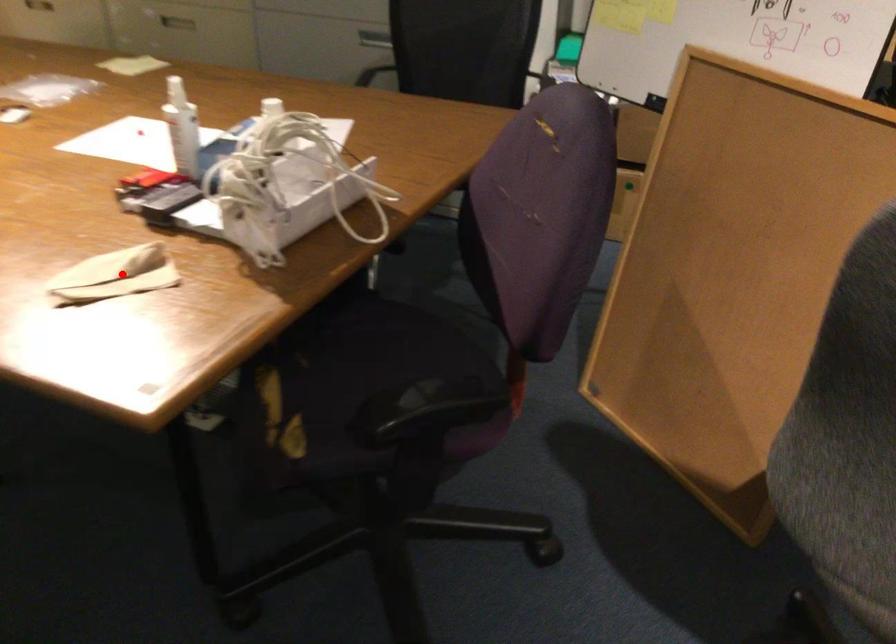
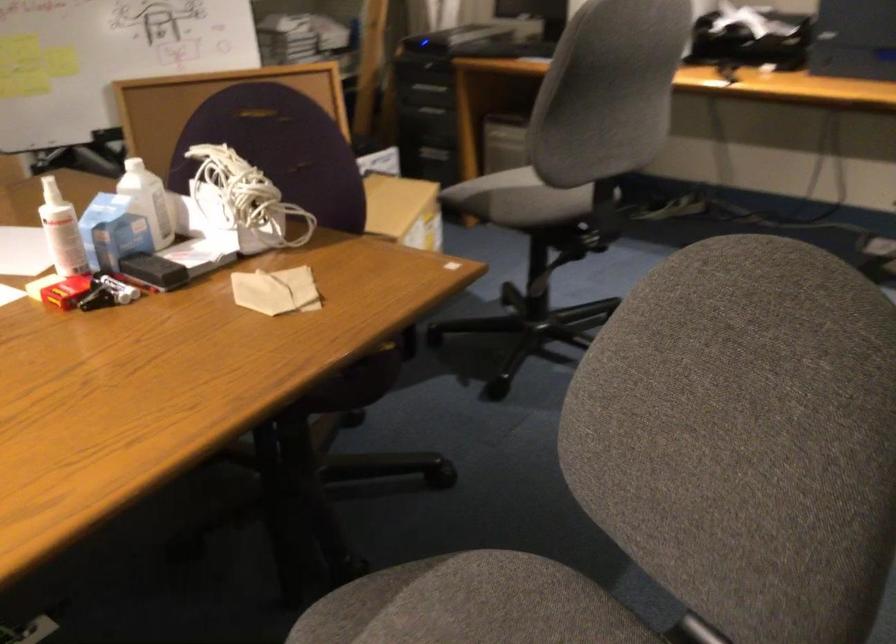
Question: I am providing you with two images of the same scene from different viewpoints. Given a red point in image1, look at the same physical point in image2. Is it:

Choices:
 (A) Closer to the viewpoint
 (B) Farther from the viewpoint

Answer: (B)